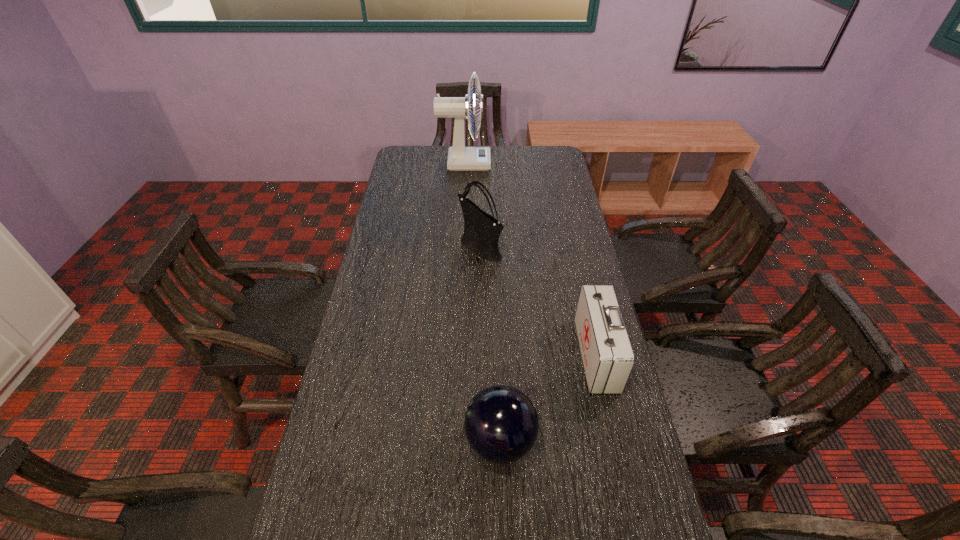
In order to click on the tallest object in this screenshot , I will do `click(460, 158)`.

Identify the location of fan. The image size is (960, 540). (460, 158).

The image size is (960, 540). I want to click on shoulder bag, so click(x=481, y=233).

Image resolution: width=960 pixels, height=540 pixels. I want to click on the second tallest object, so point(481,233).

The height and width of the screenshot is (540, 960). What are the coordinates of `the nearest object` in the screenshot? It's located at (501, 424).

The width and height of the screenshot is (960, 540). I want to click on the second nearest object, so click(608, 358).

Image resolution: width=960 pixels, height=540 pixels. In order to click on the first-aid kit in this screenshot , I will do tap(608, 358).

Where is `free space located 0.310m on the front-facing side of the fan`? This screenshot has height=540, width=960. free space located 0.310m on the front-facing side of the fan is located at coordinates (559, 163).

This screenshot has height=540, width=960. I want to click on vacant space located 0.350m on the back of the third shortest object, so click(480, 180).

This screenshot has height=540, width=960. I want to click on free region located 0.320m on the side of the bowling ball with the finger holes, so click(331, 441).